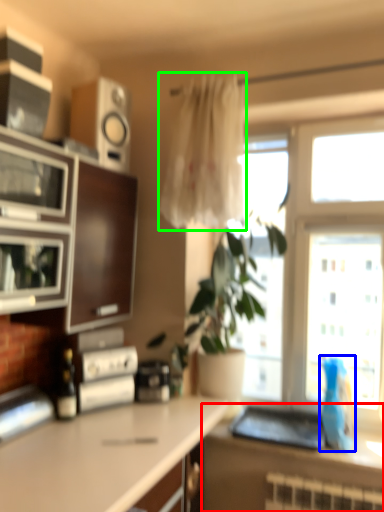
Question: Estimate the real-world distances between objects in this image. Which object is closer to countertop (highlighted by a red box), parrot (highlighted by a blue box) or curtain (highlighted by a green box)?

Choices:
 (A) parrot
 (B) curtain

Answer: (A)